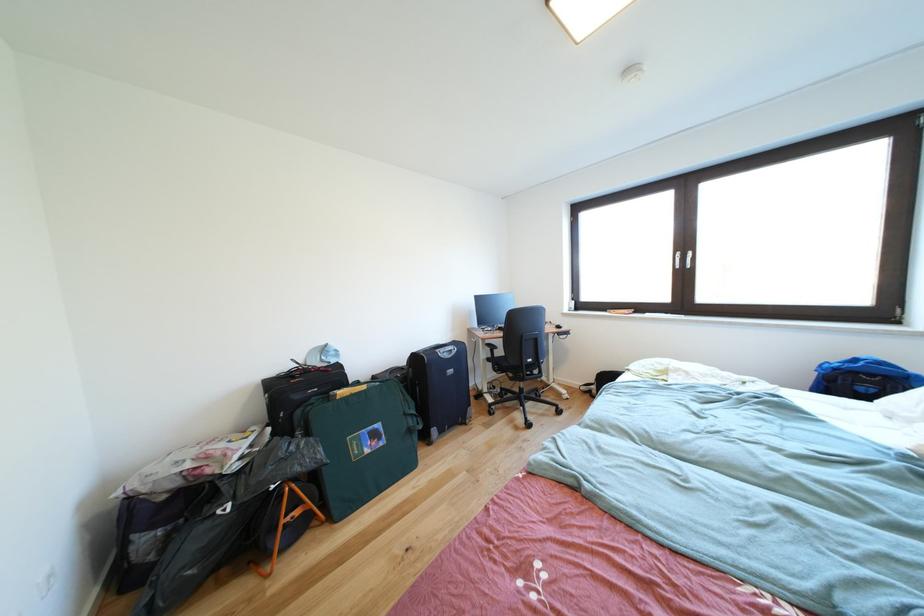
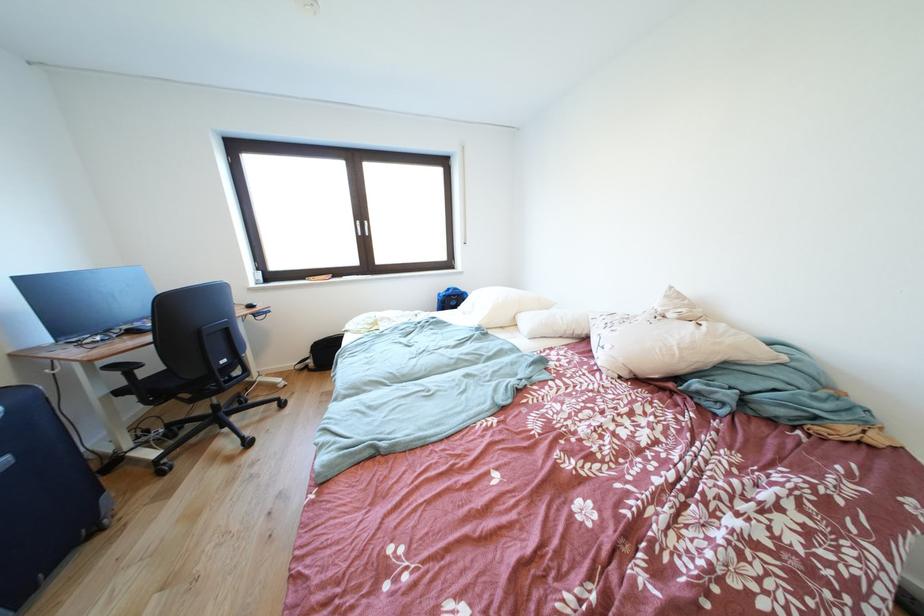
The point at (599, 395) is marked in the first image. Where is the corresponding point in the second image?

(315, 371)